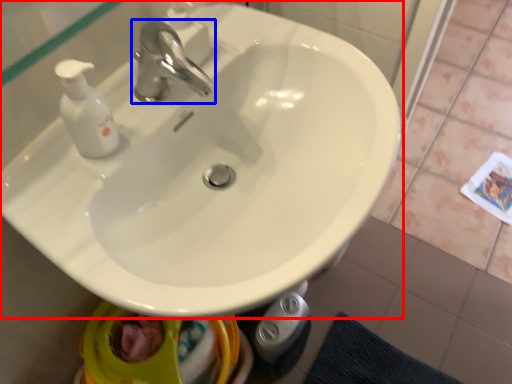
Question: Which object appears farthest to the camera in this image, sink (highlighted by a red box) or tap (highlighted by a blue box)?

Choices:
 (A) sink
 (B) tap

Answer: (B)